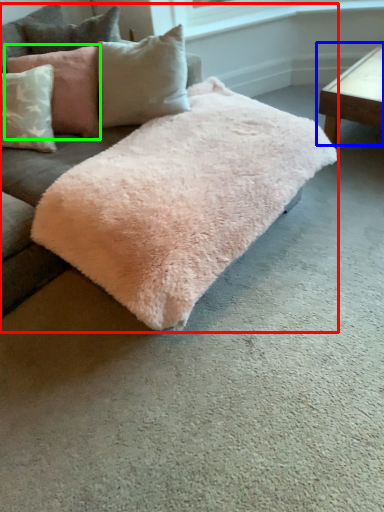
Question: Which is farther away from studio couch (highlighted by a red box)? table (highlighted by a blue box) or pillow (highlighted by a green box)?

Choices:
 (A) table
 (B) pillow

Answer: (A)